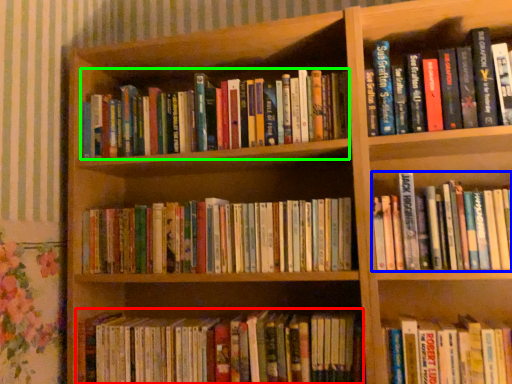
Question: Based on their relative distances, which object is nearer to book (highlighted by a red box)? Choose from book (highlighted by a blue box) and book (highlighted by a green box).

Choices:
 (A) book
 (B) book

Answer: (A)